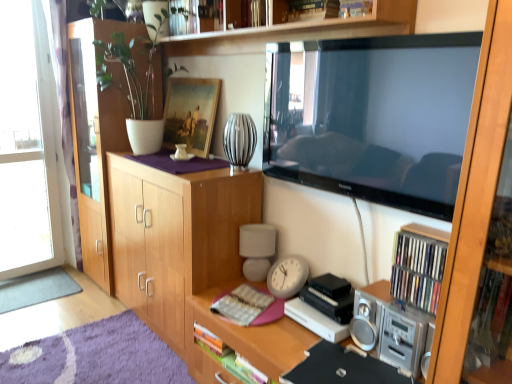
Question: From the image's perspective, is hardcover book at center located above or below gray carpet at lower left?

Choices:
 (A) below
 (B) above

Answer: (B)

Question: Which is correct: hardcover book at center is inside gray carpet at lower left, or outside of it?

Choices:
 (A) outside
 (B) inside

Answer: (A)

Question: Which of these objects is positioned farthest from the wooden cabinet at left, which is the 2th cabinetry in right-to-left order?

Choices:
 (A) hardcover book at center
 (B) light brown wood cabinet at center, which is the 1th cabinetry from right to left
 (C) wooden picture frame at upper center
 (D) wooden desk at center
 (E) transparent glass door at left

Answer: (A)

Question: Which object is positioned closest to the gray carpet at lower left?

Choices:
 (A) wooden at upper center
 (B) hardcover book at center
 (C) wooden picture frame at upper center
 (D) silver metallic stereo at lower right
 (E) transparent glass door at left

Answer: (E)